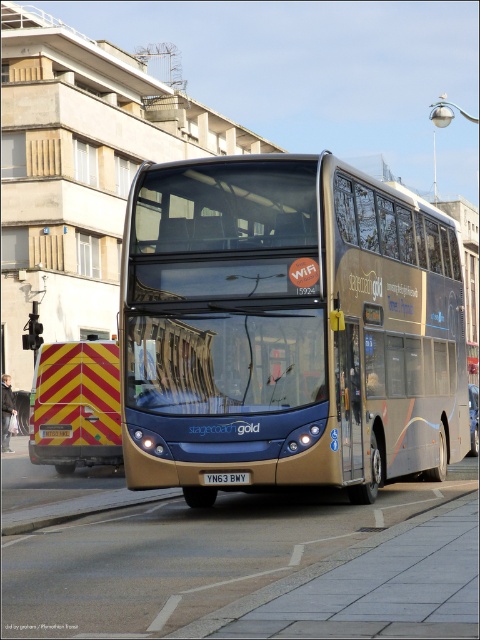
You are a city planner reviewing a city map and see the gold metallic bus at center and the white plastic license plate at center in the image. Which object is higher in elevation from the ground?

The gold metallic bus at center is taller than the white plastic license plate at center, so the gold metallic bus at center is higher in elevation from the ground.